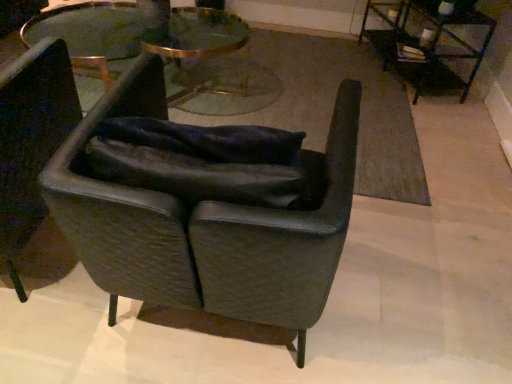
Question: Is clear glass table at center, the second table from the right, bigger than leather armchair at center, the 1th chair when ordered from right to left?

Choices:
 (A) no
 (B) yes

Answer: (B)

Question: Is clear glass table at center, the second table from the right, further to the viewer compared to leather armchair at center, which is the 2th chair in left-to-right order?

Choices:
 (A) yes
 (B) no

Answer: (A)

Question: From the image's perspective, does clear glass table at center, the first table in the left-to-right sequence, appear lower than leather armchair at center, which is the 2th chair in left-to-right order?

Choices:
 (A) no
 (B) yes

Answer: (A)

Question: Considering the relative sizes of clear glass table at center, the second table from the right, and leather armchair at center, which is the 2th chair in left-to-right order, in the image provided, is clear glass table at center, the second table from the right, thinner than leather armchair at center, which is the 2th chair in left-to-right order,?

Choices:
 (A) yes
 (B) no

Answer: (B)

Question: Considering the relative sizes of clear glass table at center, the second table from the right, and leather armchair at center, the 1th chair when ordered from right to left, in the image provided, is clear glass table at center, the second table from the right, wider than leather armchair at center, the 1th chair when ordered from right to left,?

Choices:
 (A) no
 (B) yes

Answer: (B)

Question: In terms of size, does leather at left, placed as the first chair when sorted from left to right, appear bigger or smaller than clear glass table at center, the second table from the right?

Choices:
 (A) small
 (B) big

Answer: (A)

Question: Considering the positions of point (8, 244) and point (218, 13), is point (8, 244) closer or farther from the camera than point (218, 13)?

Choices:
 (A) farther
 (B) closer

Answer: (B)

Question: Considering the positions of leather at left, placed as the first chair when sorted from left to right, and clear glass table at center, the first table in the left-to-right sequence, in the image, is leather at left, placed as the first chair when sorted from left to right, taller or shorter than clear glass table at center, the first table in the left-to-right sequence,?

Choices:
 (A) short
 (B) tall

Answer: (B)

Question: Considering their positions, is leather at left, which appears as the second chair when viewed from the right, located in front of or behind clear glass table at center, the first table in the left-to-right sequence?

Choices:
 (A) front
 (B) behind

Answer: (A)

Question: Choose the correct answer: Is clear glass table at center, the second table from the right, inside leather at left, placed as the first chair when sorted from left to right, or outside it?

Choices:
 (A) outside
 (B) inside

Answer: (A)

Question: Considering their positions, is clear glass table at center, the first table in the left-to-right sequence, located in front of or behind leather at left, placed as the first chair when sorted from left to right?

Choices:
 (A) behind
 (B) front

Answer: (A)

Question: Considering the positions of point (26, 38) and point (18, 291), is point (26, 38) closer or farther from the camera than point (18, 291)?

Choices:
 (A) farther
 (B) closer

Answer: (A)

Question: In terms of size, does clear glass table at center, the first table in the left-to-right sequence, appear bigger or smaller than leather at left, placed as the first chair when sorted from left to right?

Choices:
 (A) small
 (B) big

Answer: (B)

Question: Considering their positions, is leather armchair at center, the 1th chair when ordered from right to left, located in front of or behind metallic black table at upper right, which ranks as the second table in left-to-right order?

Choices:
 (A) behind
 (B) front

Answer: (B)

Question: Considering the positions of leather armchair at center, the 1th chair when ordered from right to left, and metallic black table at upper right, which ranks as the second table in left-to-right order, in the image, is leather armchair at center, the 1th chair when ordered from right to left, taller or shorter than metallic black table at upper right, which ranks as the second table in left-to-right order,?

Choices:
 (A) short
 (B) tall

Answer: (B)